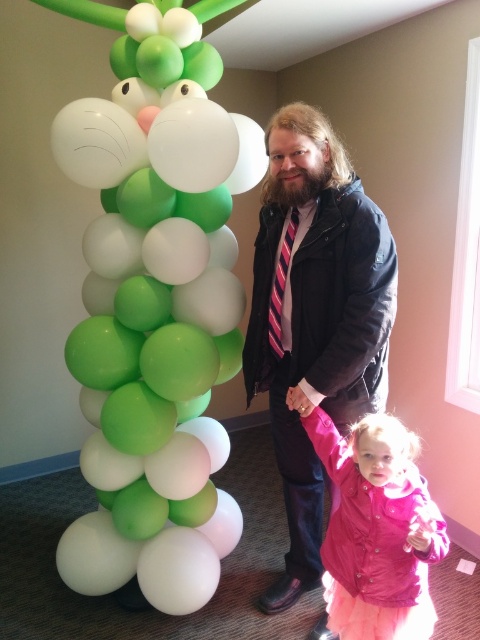
Is green matte balloon column at left to the left of dark blue jacket at center from the viewer's perspective?

Indeed, green matte balloon column at left is positioned on the left side of dark blue jacket at center.

Can you confirm if green matte balloon column at left is positioned above dark blue jacket at center?

Indeed, green matte balloon column at left is positioned over dark blue jacket at center.

Identify the location of green matte balloon column at left. The height and width of the screenshot is (640, 480). (156, 304).

Between dark blue jacket at center and striped fabric tie at center, which one appears on the left side from the viewer's perspective?

Positioned to the left is striped fabric tie at center.

Is point (367, 412) in front of point (279, 289)?

Yes, it is in front of point (279, 289).

At what (x,y) coordinates should I click in order to perform the action: click on dark blue jacket at center. Please return your answer as a coordinate pair (x, y). The width and height of the screenshot is (480, 640). Looking at the image, I should click on (314, 317).

The height and width of the screenshot is (640, 480). What do you see at coordinates (156, 304) in the screenshot?
I see `green matte balloon column at left` at bounding box center [156, 304].

Where is `green matte balloon column at left`? green matte balloon column at left is located at coordinates (156, 304).

Is point (116, 54) behind point (289, 237)?

Yes, it is behind point (289, 237).

Where is `green matte balloon column at left`? The width and height of the screenshot is (480, 640). green matte balloon column at left is located at coordinates (156, 304).